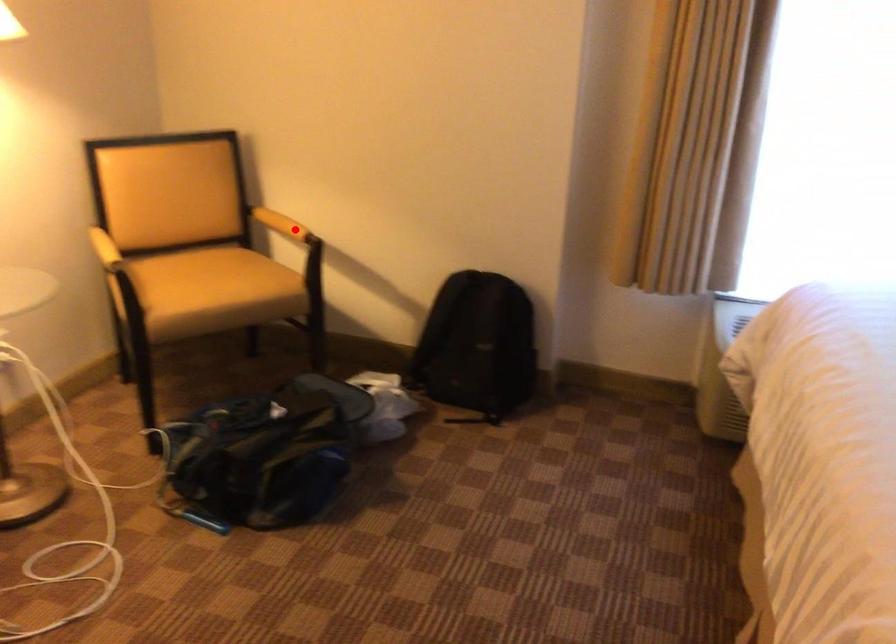
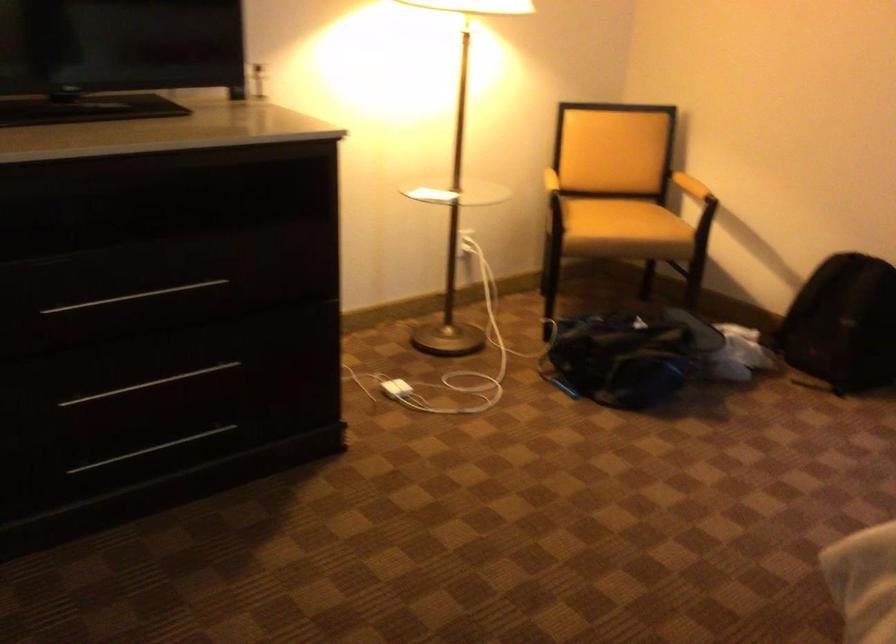
In the second image, find the point that corresponds to the highlighted location in the first image.

(690, 185)